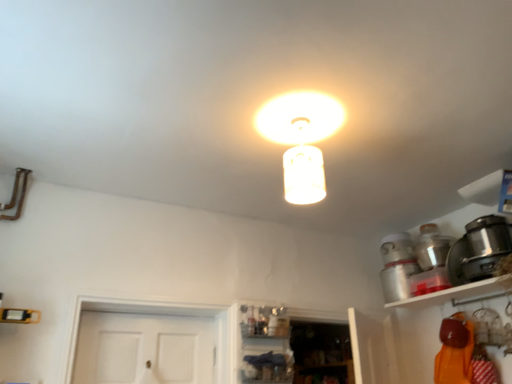
Question: From a real-world perspective, is white glossy shelf at upper right located higher than metallic silver pot at upper right, which is the first appliance from back to front?

Choices:
 (A) no
 (B) yes

Answer: (A)

Question: Would you consider white glossy shelf at upper right to be distant from metallic silver pot at upper right, which is the first appliance from back to front?

Choices:
 (A) no
 (B) yes

Answer: (A)

Question: Is white glossy shelf at upper right to the right of metallic silver pot at upper right, which is the first appliance from back to front, from the viewer's perspective?

Choices:
 (A) no
 (B) yes

Answer: (B)

Question: From the image's perspective, is white glossy shelf at upper right over metallic silver pot at upper right, which is the first appliance from back to front?

Choices:
 (A) yes
 (B) no

Answer: (B)

Question: Does white glossy shelf at upper right have a smaller size compared to metallic silver pot at upper right, which is the first appliance from back to front?

Choices:
 (A) no
 (B) yes

Answer: (A)

Question: Is metallic silver pot at upper right, which is the first appliance from back to front, at the back of white glossy shelf at upper right?

Choices:
 (A) no
 (B) yes

Answer: (A)

Question: Does matte glass lampshade at center appear on the left side of metallic silver pot at upper right, which is the first appliance from back to front?

Choices:
 (A) no
 (B) yes

Answer: (B)

Question: Does matte glass lampshade at center have a greater height compared to metallic silver pot at upper right, the second appliance in the front-to-back sequence?

Choices:
 (A) no
 (B) yes

Answer: (B)

Question: From the image's perspective, is matte glass lampshade at center on top of metallic silver pot at upper right, which is the first appliance from back to front?

Choices:
 (A) yes
 (B) no

Answer: (A)

Question: Can we say matte glass lampshade at center lies outside metallic silver pot at upper right, which is the first appliance from back to front?

Choices:
 (A) yes
 (B) no

Answer: (A)

Question: Considering the relative sizes of matte glass lampshade at center and metallic silver pot at upper right, which is the first appliance from back to front, in the image provided, is matte glass lampshade at center wider than metallic silver pot at upper right, which is the first appliance from back to front,?

Choices:
 (A) no
 (B) yes

Answer: (A)

Question: From a real-world perspective, is matte glass lampshade at center located higher than metallic silver pot at upper right, the second appliance in the front-to-back sequence?

Choices:
 (A) no
 (B) yes

Answer: (B)

Question: Is matte glass lampshade at center bigger than satin black pot at right, which is counted as the 1th appliance, starting from the front?

Choices:
 (A) no
 (B) yes

Answer: (B)